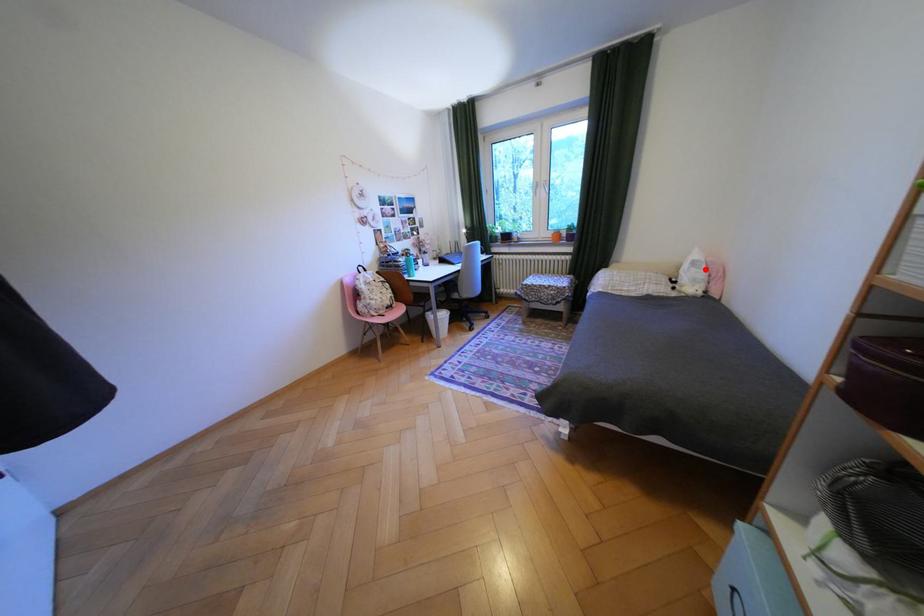
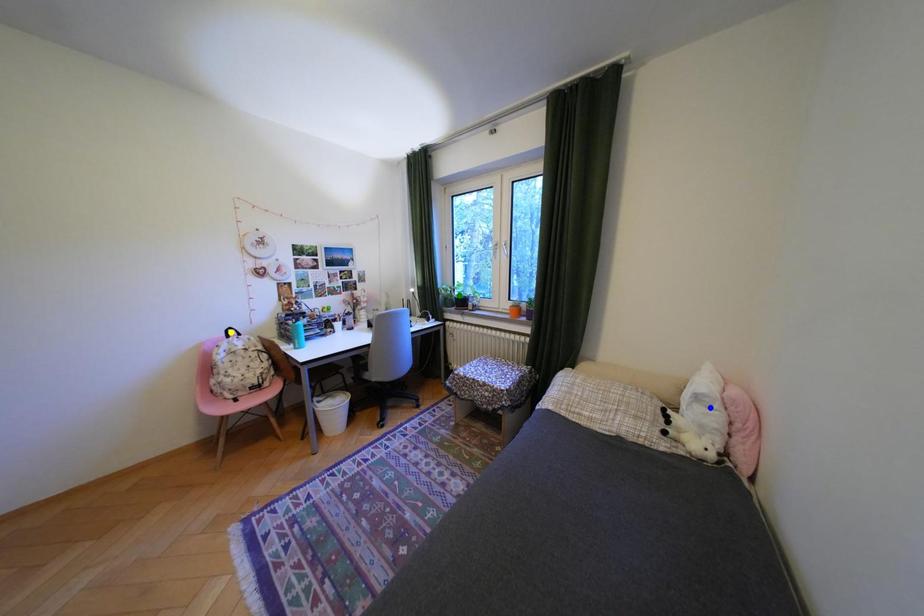
Question: I am providing you with two images of the same scene from different viewpoints. A red point is marked on the first image. You are given multiple points on the second image. In image 2, which mark is for the same physical point as the one in image 1?

Choices:
 (A) blue point
 (B) yellow point
 (C) green point

Answer: (A)